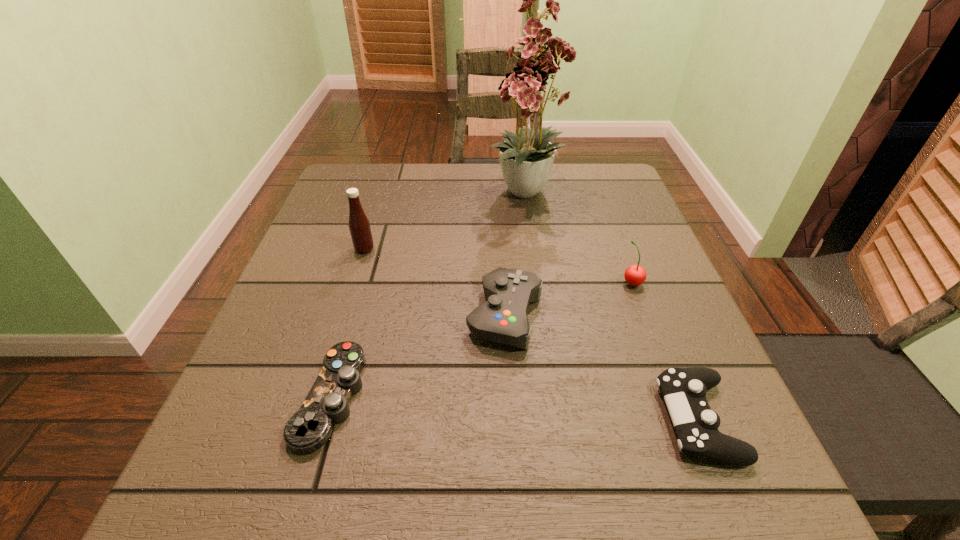
Where is `the shortest control`? the shortest control is located at coordinates (308, 429).

This screenshot has height=540, width=960. Find the location of `vacant region located on the front-facing side of the farthest object`. vacant region located on the front-facing side of the farthest object is located at coordinates (555, 366).

What are the coordinates of `blank area located 0.310m on the front of the second farthest object` in the screenshot? It's located at (327, 370).

The width and height of the screenshot is (960, 540). I want to click on blank space located on the front of the fourth shortest object, so click(x=643, y=313).

The image size is (960, 540). Identify the location of vacant area situated on the right of the fourth tallest object. (659, 316).

Locate an element on the screen. Image resolution: width=960 pixels, height=540 pixels. vacant region located on the surface of the second shortest object is located at coordinates (554, 420).

You are a GUI agent. You are given a task and a screenshot of the screen. Output one action in this format:
    pyautogui.click(x=<x>, y=<y>)
    Task: Click on the free space located 0.070m on the surface of the second shortest object
    
    Given the screenshot: What is the action you would take?
    pyautogui.click(x=618, y=420)

Identify the location of vacant area located on the surface of the second shortest object. (405, 420).

You are a GUI agent. You are given a task and a screenshot of the screen. Output one action in this format:
    pyautogui.click(x=<x>, y=<y>)
    Task: Click on the free region located on the right of the leftmost control
    The height and width of the screenshot is (540, 960).
    Given the screenshot: What is the action you would take?
    pyautogui.click(x=570, y=397)

The height and width of the screenshot is (540, 960). What are the coordinates of `object that is positioned at the far edge` in the screenshot? It's located at (524, 160).